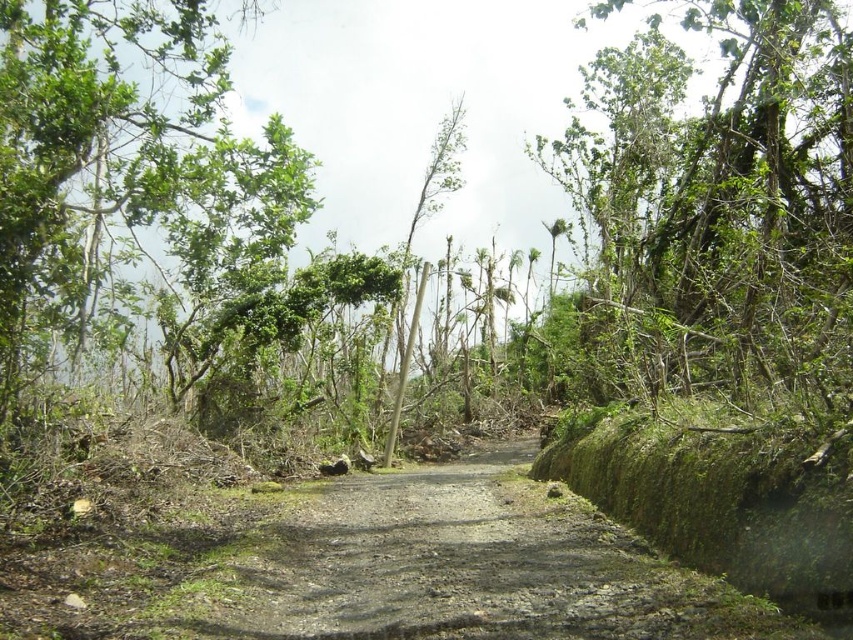
You are a hiker planning to walk along the dirt path in the forest. You notice two trees, the green leafy tree at upper right and the green leafy tree at upper left. Which tree has a wider trunk? Please base your answer on the scene details.

The green leafy tree at upper right has a wider trunk than the green leafy tree at upper left.

You are a hiker trying to navigate through the forest. You see a green leafy tree at upper right. Is this tree located near the center of the image or closer to the edge?

The green leafy tree at upper right is located at point (723, 202), which is closer to the edge of the image rather than the center.